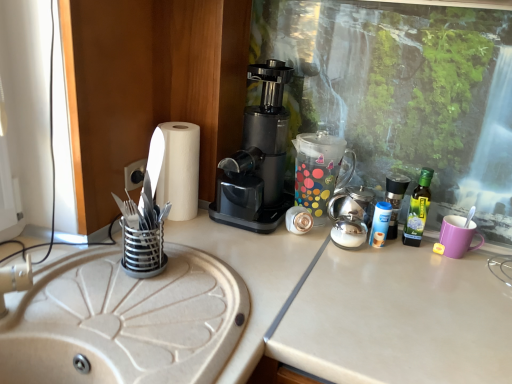
Question: Looking at the image, does black plastic socket at center-left seem bigger or smaller compared to black plastic coffee maker at center?

Choices:
 (A) small
 (B) big

Answer: (A)

Question: From a real-world perspective, relative to black plastic coffee maker at center, is black plastic socket at center-left vertically above or below?

Choices:
 (A) above
 (B) below

Answer: (B)

Question: Estimate the real-world distances between objects in this image. Which object is farther from the transparent polka dot coffee pot at center?

Choices:
 (A) black plastic coffee maker at center
 (B) green glass bottle at right, the 1th bottle viewed from the right
 (C) blue plastic bottle at right, which is the first bottle in left-to-right order
 (D) beige matte sink at left
 (E) white paper towel at left

Answer: (D)

Question: Considering the real-world distances, which object is farthest from the satin silver teapot at center-right?

Choices:
 (A) white paper towel at left
 (B) green glass bottle at right, the 1th bottle viewed from the right
 (C) beige matte sink at left
 (D) black plastic coffee maker at center
 (E) black plastic socket at center-left

Answer: (C)